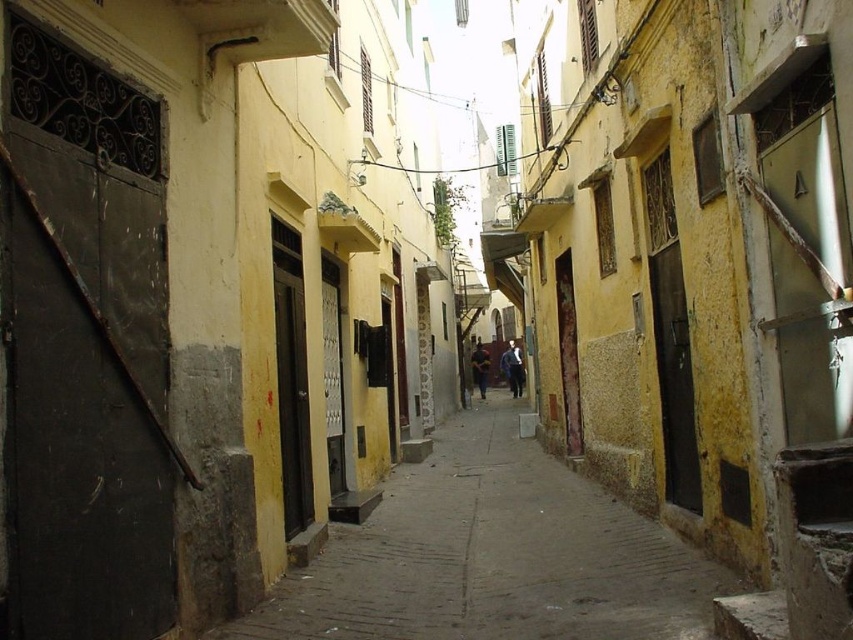
Can you confirm if smooth concrete pavement at center is positioned above blue denim jacket at center?

Incorrect, smooth concrete pavement at center is not positioned above blue denim jacket at center.

Is smooth concrete pavement at center to the left of blue denim jacket at center from the viewer's perspective?

Correct, you'll find smooth concrete pavement at center to the left of blue denim jacket at center.

Is point (409, 502) in front of point (519, 394)?

Yes, point (409, 502) is closer to viewer.

Where is `smooth concrete pavement at center`? Image resolution: width=853 pixels, height=640 pixels. smooth concrete pavement at center is located at coordinates (492, 556).

Is smooth concrete pavement at center below yellow fabric jacket at center?

Yes, smooth concrete pavement at center is below yellow fabric jacket at center.

Who is more forward, (x=548, y=468) or (x=473, y=378)?

Point (x=548, y=468)

This screenshot has width=853, height=640. Find the location of `smooth concrete pavement at center`. smooth concrete pavement at center is located at coordinates (492, 556).

Between point (518, 384) and point (473, 376), which one is positioned behind?

Point (473, 376)

Is blue denim jacket at center to the left of yellow fabric jacket at center from the viewer's perspective?

Incorrect, blue denim jacket at center is not on the left side of yellow fabric jacket at center.

Does point (508, 372) come behind point (486, 360)?

Yes, it is.

At what (x,y) coordinates should I click in order to perform the action: click on blue denim jacket at center. Please return your answer as a coordinate pair (x, y). Looking at the image, I should click on (514, 369).